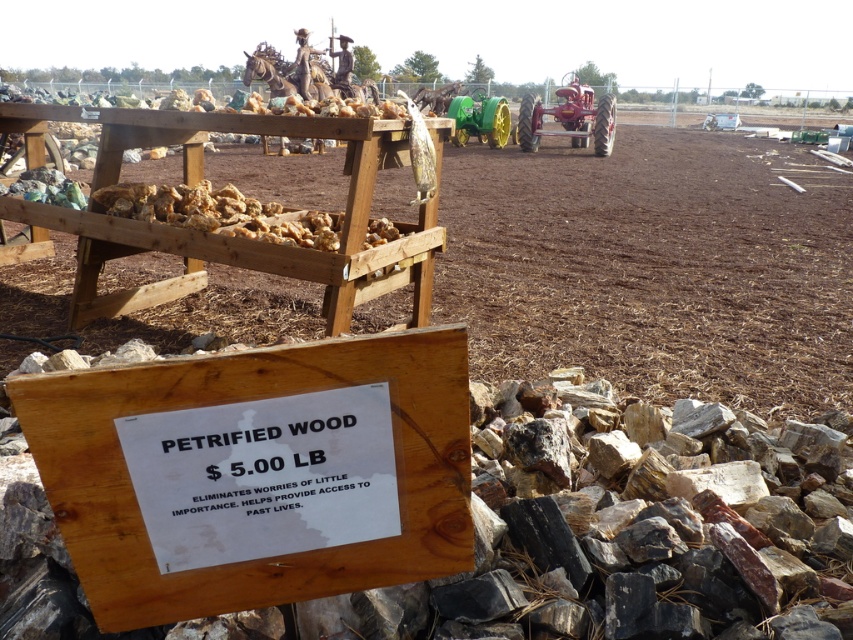
Question: Which object is farther from the camera taking this photo?

Choices:
 (A) red metal tractor at center
 (B) wooden sign at lower center

Answer: (A)

Question: Can you confirm if brown mulch at center is positioned below red metal tractor at center?

Choices:
 (A) no
 (B) yes

Answer: (B)

Question: Which object is positioned farthest from the brown mulch at center?

Choices:
 (A) wooden sign at lower center
 (B) green rubber tractor at center
 (C) red metal tractor at center

Answer: (B)

Question: Which point appears farthest from the camera in this image?

Choices:
 (A) (x=489, y=132)
 (B) (x=47, y=285)
 (C) (x=555, y=93)

Answer: (C)

Question: Is brown mulch at center bigger than red metal tractor at center?

Choices:
 (A) yes
 (B) no

Answer: (B)

Question: Can you confirm if brown mulch at center is bigger than green rubber tractor at center?

Choices:
 (A) no
 (B) yes

Answer: (B)